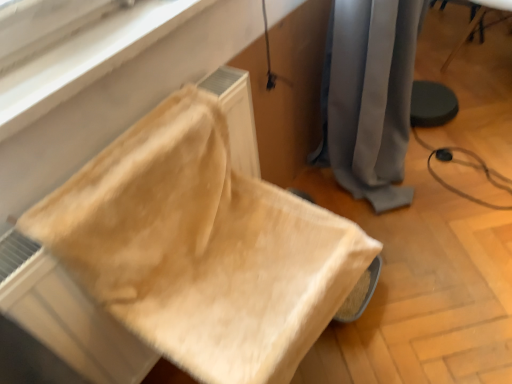
Question: Does beige fabric cushion at lower left, marked as the 2th furniture in a back-to-front arrangement, appear on the right side of gray fabric curtain at center?

Choices:
 (A) yes
 (B) no

Answer: (B)

Question: Is beige fabric cushion at lower left, placed as the 2th furniture when sorted from top to bottom, thinner than gray fabric curtain at center?

Choices:
 (A) yes
 (B) no

Answer: (B)

Question: From a real-world perspective, is beige fabric cushion at lower left, placed as the 2th furniture when sorted from top to bottom, under gray fabric curtain at center?

Choices:
 (A) yes
 (B) no

Answer: (B)

Question: Does beige fabric cushion at lower left, marked as the 2th furniture in a back-to-front arrangement, have a smaller size compared to gray fabric curtain at center?

Choices:
 (A) yes
 (B) no

Answer: (A)

Question: Is beige fabric cushion at lower left, which ranks as the 1th furniture in left-to-right order, positioned before gray fabric curtain at center?

Choices:
 (A) no
 (B) yes

Answer: (B)

Question: Considering the relative positions of wooden chair at lower right, placed as the second furniture when sorted from left to right, and beige fabric cushion at lower left, which is the 1th furniture in front-to-back order, in the image provided, is wooden chair at lower right, placed as the second furniture when sorted from left to right, to the left or to the right of beige fabric cushion at lower left, which is the 1th furniture in front-to-back order,?

Choices:
 (A) right
 (B) left

Answer: (A)

Question: Is wooden chair at lower right, positioned as the second furniture in front-to-back order, wider or thinner than beige fabric cushion at lower left, which ranks as the 1th furniture in left-to-right order?

Choices:
 (A) wide
 (B) thin

Answer: (B)

Question: Does point coord(454,51) appear closer or farther from the camera than point coord(265,360)?

Choices:
 (A) farther
 (B) closer

Answer: (A)

Question: From a real-world perspective, relative to beige fabric cushion at lower left, the 1th furniture when ordered from bottom to top, is wooden chair at lower right, arranged as the first furniture when viewed from the top, vertically above or below?

Choices:
 (A) above
 (B) below

Answer: (B)

Question: From the image's perspective, is wooden chair at lower right, positioned as the second furniture in front-to-back order, positioned above or below gray fabric curtain at center?

Choices:
 (A) above
 (B) below

Answer: (A)

Question: Considering the positions of wooden chair at lower right, arranged as the first furniture when viewed from the top, and gray fabric curtain at center in the image, is wooden chair at lower right, arranged as the first furniture when viewed from the top, taller or shorter than gray fabric curtain at center?

Choices:
 (A) short
 (B) tall

Answer: (A)

Question: Considering the positions of wooden chair at lower right, the 1th furniture in the back-to-front sequence, and gray fabric curtain at center in the image, is wooden chair at lower right, the 1th furniture in the back-to-front sequence, wider or thinner than gray fabric curtain at center?

Choices:
 (A) wide
 (B) thin

Answer: (A)

Question: In terms of size, does wooden chair at lower right, placed as the second furniture when sorted from left to right, appear bigger or smaller than gray fabric curtain at center?

Choices:
 (A) small
 (B) big

Answer: (A)

Question: From the image's perspective, relative to gray fabric curtain at center, is beige fabric cushion at lower left, which ranks as the 1th furniture in left-to-right order, above or below?

Choices:
 (A) below
 (B) above

Answer: (A)

Question: Considering their positions, is beige fabric cushion at lower left, which ranks as the 1th furniture in left-to-right order, located in front of or behind gray fabric curtain at center?

Choices:
 (A) front
 (B) behind

Answer: (A)